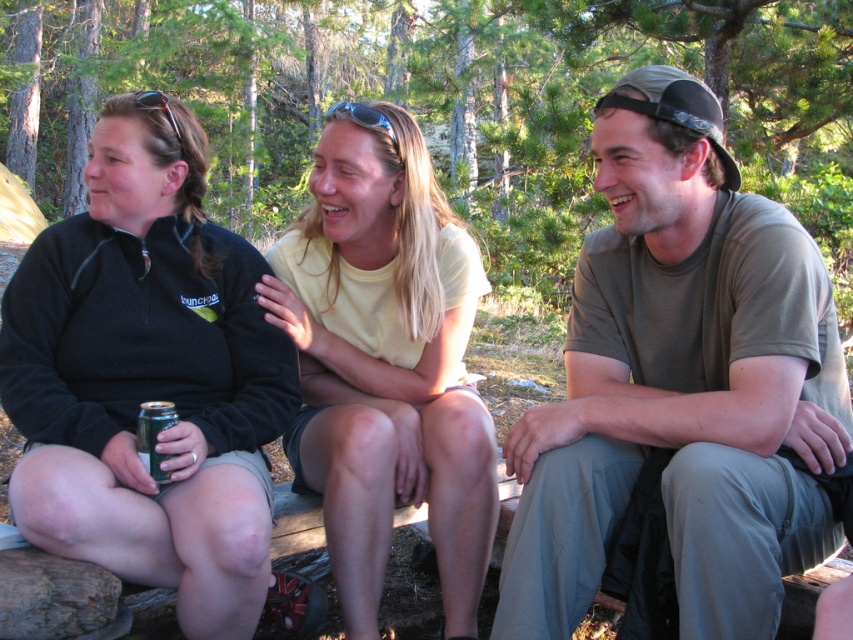
You are standing at the origin point in the forest scene. There are two points marked in the image. Which point is closer to you, point [685,520] or point [430,486]?

Point [685,520] is in front of point [430,486], so it is closer to you.

You are a photographer planning to take a group photo of the people in the forest scene. You need to ensure that all subjects are visible. Considering the sizes of the black fleece jacket at left and yellow cotton shirt at center, which person should you position closer to the camera to maintain visibility?

The black fleece jacket at left is wider than the yellow cotton shirt at center, so positioning the person in the black fleece jacket at left closer to the camera will help maintain visibility as their larger size may require more space in the frame.